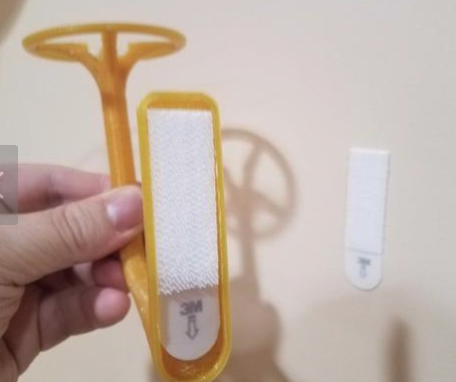
The width and height of the screenshot is (456, 382). What are the coordinates of `wall` in the screenshot? It's located at (315, 59).